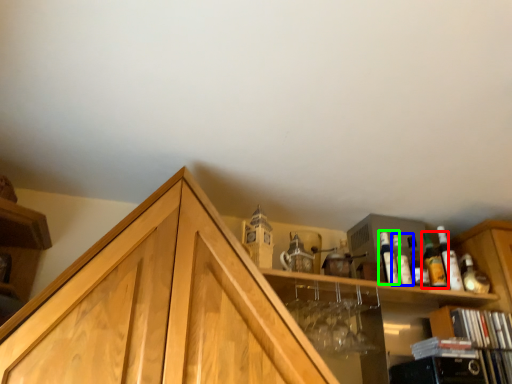
Question: Which object is the closest to the beer bottle (highlighted by a red box)? Choose among these: bottle (highlighted by a blue box) or bottle (highlighted by a green box).

Choices:
 (A) bottle
 (B) bottle

Answer: (A)